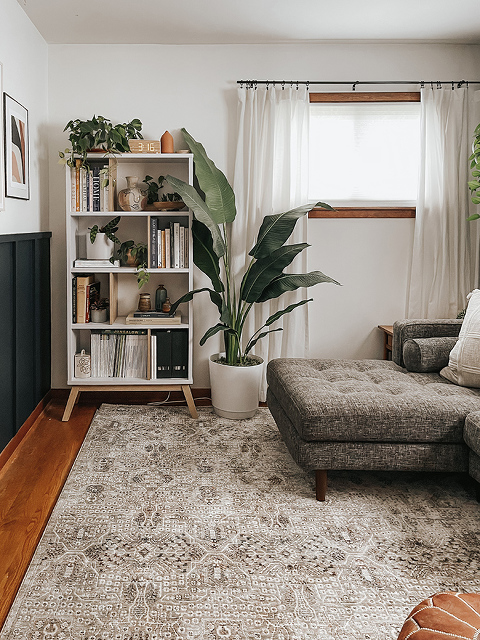
At what (x,y) coordinates should I click in order to perform the action: click on plant. Please return your answer as a coordinate pair (x, y). The height and width of the screenshot is (640, 480). Looking at the image, I should click on (233, 321), (94, 130), (133, 246), (97, 233), (167, 198).